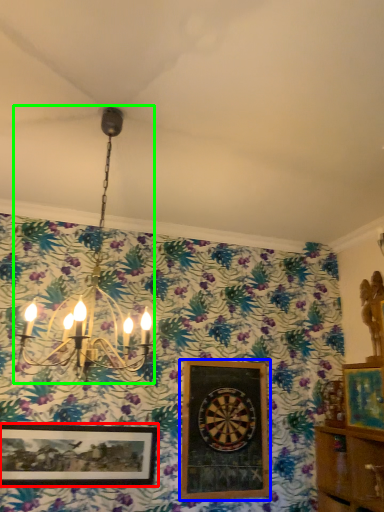
Question: Which object is the farthest from picture frame (highlighted by a red box)? Choose among these: picture frame (highlighted by a blue box) or lamp (highlighted by a green box).

Choices:
 (A) picture frame
 (B) lamp

Answer: (B)